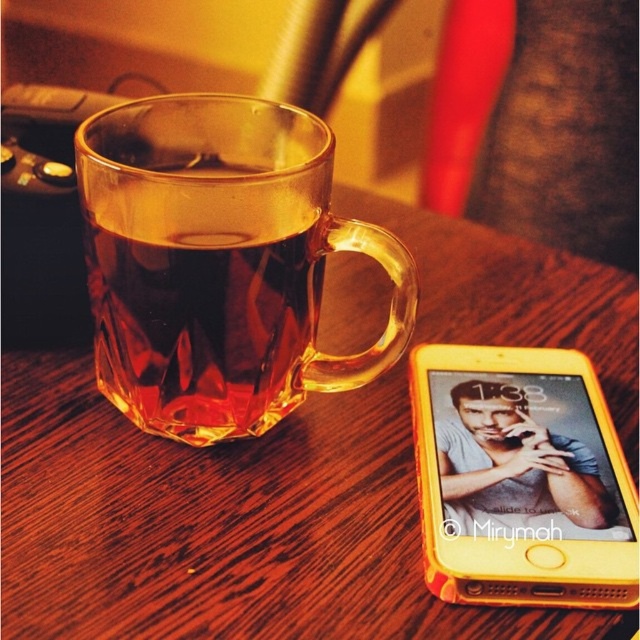
You are looking at the scene from above. There are two points marked in the image, one at coordinates point [404,452] and another at point [632,490]. Which point is closer to you?

Point [632,490] is closer to you because it is in front of point [404,452].

You have a ruler that measures in centimeters. You need to measure the distance between the point at point (42, 422) and the smartphone with a yellow case to the right of the mug. Can you determine if the distance is more than 25 cm?

The distance between the point at point (42, 422) and the smartphone with a yellow case to the right of the mug is 28.14 centimeters, which is more than 25 cm.

You are standing in the room and want to place a small object on the wooden table. The transparent glass mug at left is located at point (220,262). Where should you place the object to ensure it doesn not fall off the table?

Place the object away from the edge of the table, ensuring it is centered or near the middle to prevent it from falling off.